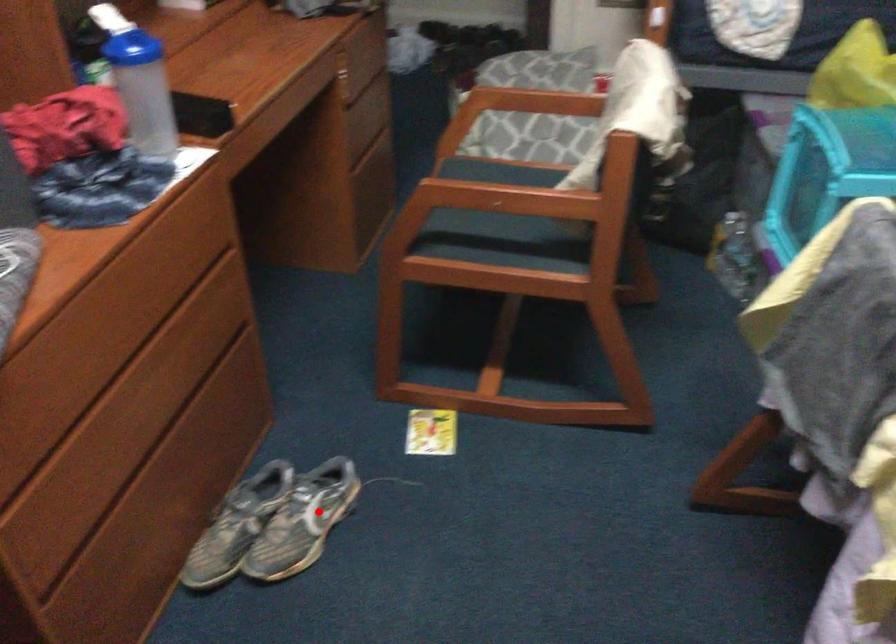
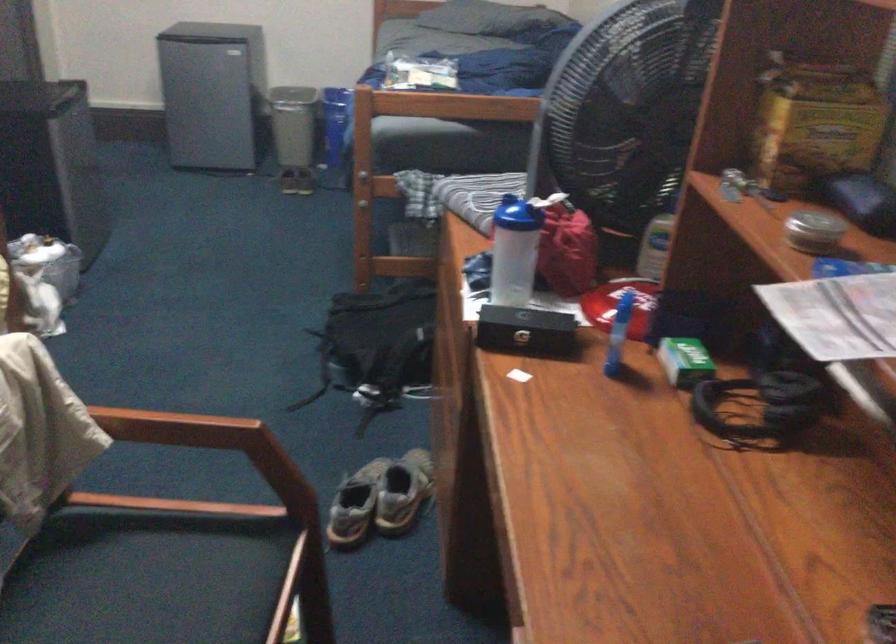
Question: I am providing you with two images of the same scene from different viewpoints. Image1 has a red point marked. In image2, the corresponding 3D location appears at what relative position? Reply with the corresponding letter.

Choices:
 (A) Closer
 (B) Farther

Answer: (B)